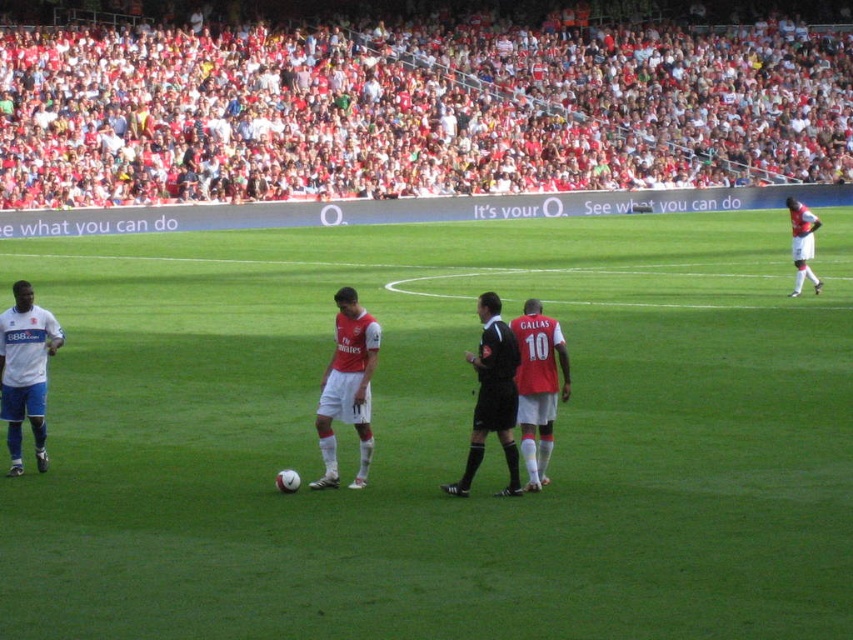
You are a photographer standing at the edge of the soccer field. You want to take a photo that includes both the white matte jersey at left and the black jersey at center. Which jersey should you adjust your camera angle to focus on to ensure both are in frame without zooming in?

A: The white matte jersey at left is taller than the black jersey at center, so you should focus on the white matte jersey at left to ensure both are visible in the frame without zooming in.

You are a drone operator trying to capture a close shot of the matte red jersey at center while avoiding the red fabric crowd at upper center. Based on their heights, which object should you focus on first to ensure the shot isn

The matte red jersey at center is shorter than the red fabric crowd at upper center, so you should focus on the matte red jersey at center first to avoid obstruction.

You are a drone operator trying to capture aerial footage of the soccer match. You notice the green grass field at center and the black jersey at center. Which object is closer to the camera from your drone perspective?

The green grass field at center is closer to the camera because it is in front of the black jersey at center.